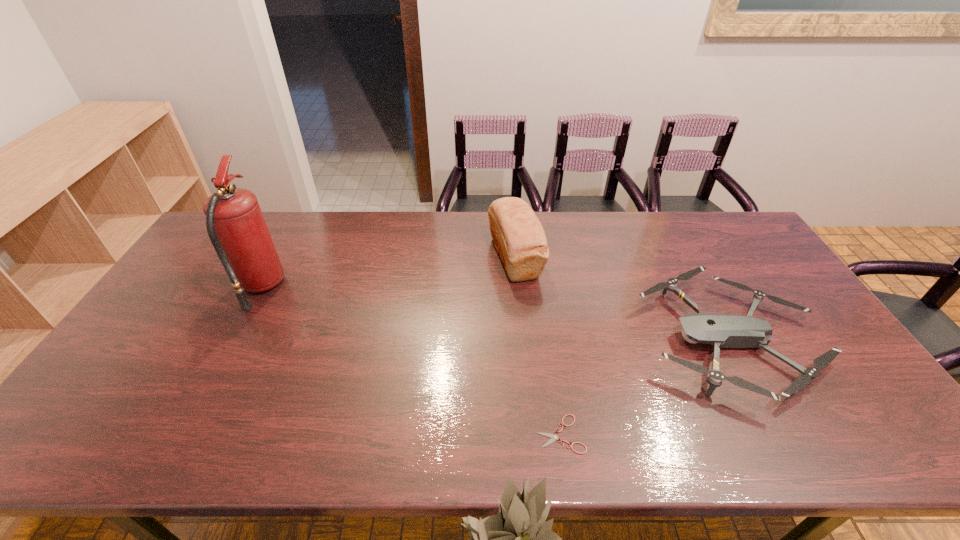
Where is `free space between the shears and the rightmost object`? free space between the shears and the rightmost object is located at coordinates (645, 387).

Locate an element on the screen. The width and height of the screenshot is (960, 540). vacant space that's between the tallest object and the bread is located at coordinates (388, 272).

This screenshot has width=960, height=540. Find the location of `free space between the bread and the leftmost object`. free space between the bread and the leftmost object is located at coordinates (388, 272).

Locate an element on the screen. Image resolution: width=960 pixels, height=540 pixels. vacant space in between the second tallest object and the shortest object is located at coordinates (538, 346).

Find the location of a particular element. Image resolution: width=960 pixels, height=540 pixels. free space between the rightmost object and the fire extinguisher is located at coordinates (495, 314).

This screenshot has height=540, width=960. Find the location of `vacant area that lies between the shears and the leftmost object`. vacant area that lies between the shears and the leftmost object is located at coordinates (411, 361).

What are the coordinates of `free space between the rightmost object and the fire extinguisher` in the screenshot? It's located at (495, 314).

Identify the location of free space between the shortest object and the rightmost object. 645,387.

This screenshot has width=960, height=540. I want to click on free space that is in between the second tallest object and the rightmost object, so click(x=623, y=299).

You are a GUI agent. You are given a task and a screenshot of the screen. Output one action in this format:
    pyautogui.click(x=<x>, y=<y>)
    Task: Click on the object that stands as the closest to the drone
    
    Given the screenshot: What is the action you would take?
    pyautogui.click(x=554, y=437)